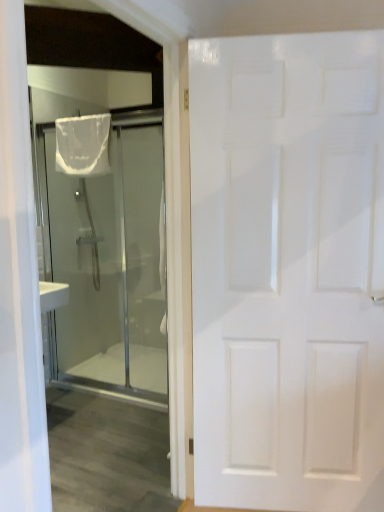
What do you see at coordinates (111, 264) in the screenshot? Image resolution: width=384 pixels, height=512 pixels. I see `transparent glass shower at left, the 2th door in the right-to-left sequence` at bounding box center [111, 264].

The height and width of the screenshot is (512, 384). What are the coordinates of `white matte door at right, which is the first door in right-to-left order` in the screenshot? It's located at (288, 270).

Looking at this image, does white sheer fabric at upper left have a larger size compared to white matte door at right, which is the first door from front to back?

Incorrect, white sheer fabric at upper left is not larger than white matte door at right, which is the first door from front to back.

How many degrees apart are the facing directions of white sheer fabric at upper left and white matte door at right, the second door in the left-to-right sequence?

They differ by 18.8 degrees in their facing directions.

In the scene shown: Would you say white sheer fabric at upper left is inside or outside white matte door at right, which is the first door in right-to-left order?

white sheer fabric at upper left exists outside the volume of white matte door at right, which is the first door in right-to-left order.

From a real-world perspective, is white sheer fabric at upper left located higher than white matte door at right, which is counted as the second door, starting from the back?

Yes, from a real-world perspective, white sheer fabric at upper left is on top of white matte door at right, which is counted as the second door, starting from the back.

Find the location of a particular element. This screenshot has height=512, width=384. shower curtain above the white matte door at right, which is the first door in right-to-left order (from the image's perspective) is located at coordinates (83, 145).

How different are the orientations of white matte door at right, which is the first door in right-to-left order, and white sheer fabric at upper left in degrees?

The angular difference between white matte door at right, which is the first door in right-to-left order, and white sheer fabric at upper left is 18.8 degrees.

Considering the sizes of white matte door at right, which is the first door in right-to-left order, and white sheer fabric at upper left in the image, is white matte door at right, which is the first door in right-to-left order, bigger or smaller than white sheer fabric at upper left?

Considering their sizes, white matte door at right, which is the first door in right-to-left order, takes up more space than white sheer fabric at upper left.

Considering the sizes of white matte door at right, which is the first door in right-to-left order, and white sheer fabric at upper left in the image, is white matte door at right, which is the first door in right-to-left order, taller or shorter than white sheer fabric at upper left?

Considering their sizes, white matte door at right, which is the first door in right-to-left order, has more height than white sheer fabric at upper left.

Based on their sizes in the image, would you say transparent glass shower at left, the 1th door in the back-to-front sequence, is bigger or smaller than white sheer fabric at upper left?

Considering their sizes, transparent glass shower at left, the 1th door in the back-to-front sequence, takes up more space than white sheer fabric at upper left.

Which is more to the left, transparent glass shower at left, which ranks as the first door in left-to-right order, or white sheer fabric at upper left?

From the viewer's perspective, white sheer fabric at upper left appears more on the left side.

The width and height of the screenshot is (384, 512). Identify the location of the 1st door below the white sheer fabric at upper left (from the image's perspective). (111, 264).

Can you confirm if transparent glass shower at left, which ranks as the first door in left-to-right order, is shorter than white sheer fabric at upper left?

No, transparent glass shower at left, which ranks as the first door in left-to-right order, is not shorter than white sheer fabric at upper left.

Is transparent glass shower at left, the second door viewed from the front, at the right side of white matte door at right, which is counted as the second door, starting from the back?

Incorrect, transparent glass shower at left, the second door viewed from the front, is not on the right side of white matte door at right, which is counted as the second door, starting from the back.

Between transparent glass shower at left, the 2th door in the right-to-left sequence, and white matte door at right, which is the first door in right-to-left order, which one has larger size?

Bigger between the two is white matte door at right, which is the first door in right-to-left order.

Does transparent glass shower at left, which ranks as the first door in left-to-right order, turn towards white matte door at right, the second door in the left-to-right sequence?

No, transparent glass shower at left, which ranks as the first door in left-to-right order, does not turn towards white matte door at right, the second door in the left-to-right sequence.

Considering the sizes of objects white matte door at right, which is the first door from front to back, and transparent glass shower at left, the 2th door in the right-to-left sequence, in the image provided, who is bigger, white matte door at right, which is the first door from front to back, or transparent glass shower at left, the 2th door in the right-to-left sequence,?

With larger size is white matte door at right, which is the first door from front to back.

Considering the relative sizes of white matte door at right, which is counted as the second door, starting from the back, and transparent glass shower at left, which ranks as the first door in left-to-right order, in the image provided, is white matte door at right, which is counted as the second door, starting from the back, thinner than transparent glass shower at left, which ranks as the first door in left-to-right order,?

No.

Is white matte door at right, which is counted as the second door, starting from the back, inside or outside of transparent glass shower at left, the second door viewed from the front?

white matte door at right, which is counted as the second door, starting from the back, is located beyond the bounds of transparent glass shower at left, the second door viewed from the front.

Is transparent glass shower at left, the second door viewed from the front, at the back of white matte door at right, which is the first door in right-to-left order?

No.

Looking at this image, is white sheer fabric at upper left not within transparent glass shower at left, which ranks as the first door in left-to-right order?

No.

Is white sheer fabric at upper left bigger or smaller than transparent glass shower at left, the second door viewed from the front?

white sheer fabric at upper left is smaller than transparent glass shower at left, the second door viewed from the front.

Between white sheer fabric at upper left and transparent glass shower at left, the second door viewed from the front, which one has more height?

transparent glass shower at left, the second door viewed from the front, is taller.

Visually, is white sheer fabric at upper left positioned to the left or to the right of transparent glass shower at left, the 2th door in the right-to-left sequence?

white sheer fabric at upper left is positioned on transparent glass shower at left, the 2th door in the right-to-left sequence,'s left side.

You are a GUI agent. You are given a task and a screenshot of the screen. Output one action in this format:
    pyautogui.click(x=<x>, y=<y>)
    Task: Click on the shower curtain that appears on the left of white matte door at right, which is the first door from front to back
    
    Given the screenshot: What is the action you would take?
    pyautogui.click(x=83, y=145)

At what (x,y) coordinates should I click in order to perform the action: click on shower curtain that is above the white matte door at right, which is the first door from front to back (from the image's perspective). Please return your answer as a coordinate pair (x, y). Image resolution: width=384 pixels, height=512 pixels. Looking at the image, I should click on (83, 145).

Considering their positions, is white matte door at right, the second door in the left-to-right sequence, positioned further to transparent glass shower at left, the 1th door in the back-to-front sequence, than white sheer fabric at upper left?

white matte door at right, the second door in the left-to-right sequence, is positioned further to the anchor transparent glass shower at left, the 1th door in the back-to-front sequence.

When comparing their distances from transparent glass shower at left, the second door viewed from the front, does white sheer fabric at upper left or white matte door at right, which is the first door in right-to-left order, seem further?

white matte door at right, which is the first door in right-to-left order, lies further to transparent glass shower at left, the second door viewed from the front, than the other object.

When comparing their distances from white sheer fabric at upper left, does white matte door at right, which is the first door in right-to-left order, or transparent glass shower at left, the 1th door in the back-to-front sequence, seem closer?

transparent glass shower at left, the 1th door in the back-to-front sequence, is closer to white sheer fabric at upper left.

Estimate the real-world distances between objects in this image. Which object is further from white matte door at right, which is the first door from front to back, white sheer fabric at upper left or transparent glass shower at left, the 2th door in the right-to-left sequence?

transparent glass shower at left, the 2th door in the right-to-left sequence, is further to white matte door at right, which is the first door from front to back.

Looking at the image, which one is located closer to white matte door at right, which is the first door from front to back, transparent glass shower at left, the 2th door in the right-to-left sequence, or white sheer fabric at upper left?

white sheer fabric at upper left lies closer to white matte door at right, which is the first door from front to back, than the other object.

In the scene shown: Based on their spatial positions, is transparent glass shower at left, which ranks as the first door in left-to-right order, or white matte door at right, which is the first door in right-to-left order, closer to white sheer fabric at upper left?

transparent glass shower at left, which ranks as the first door in left-to-right order, is closer to white sheer fabric at upper left.

Where is `door between white matte door at right, which is the first door from front to back, and white sheer fabric at upper left from front to back`? door between white matte door at right, which is the first door from front to back, and white sheer fabric at upper left from front to back is located at coordinates (111, 264).